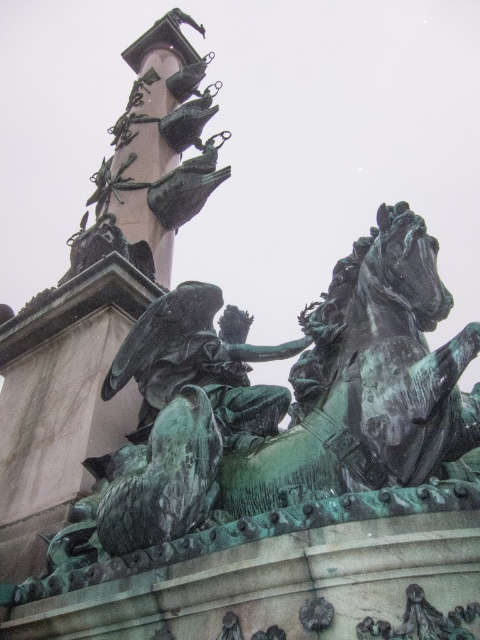
Between green patina horse at center and green patina statue at center, which one has more height?

With more height is green patina horse at center.

Is green patina horse at center smaller than green patina statue at center?

Actually, green patina horse at center might be larger than green patina statue at center.

What do you see at coordinates (368, 381) in the screenshot?
I see `green patina horse at center` at bounding box center [368, 381].

The width and height of the screenshot is (480, 640). What are the coordinates of `green patina horse at center` in the screenshot? It's located at (368, 381).